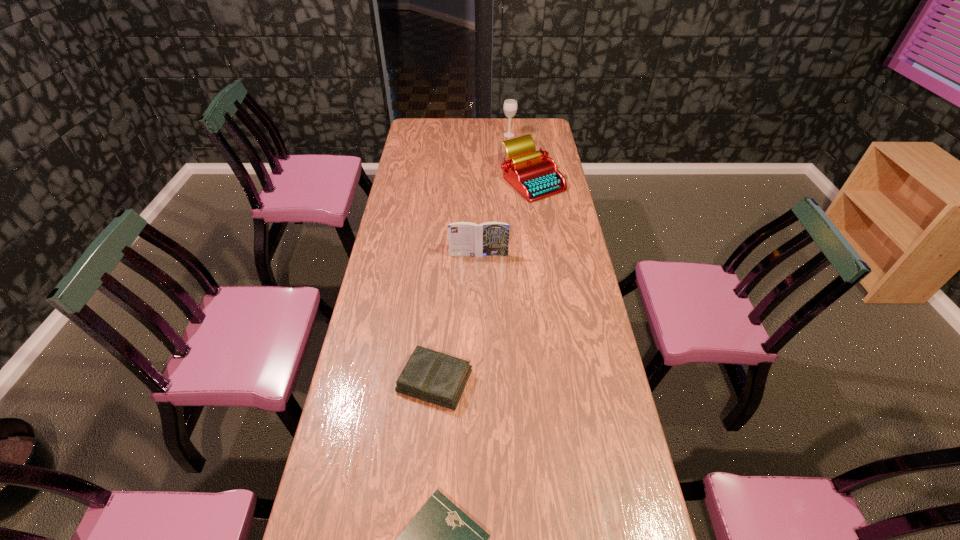
You are a GUI agent. You are given a task and a screenshot of the screen. Output one action in this format:
    pyautogui.click(x=<x>, y=<y>)
    Task: Click on the free space located on the right of the second nearest book
    The height and width of the screenshot is (540, 960).
    Given the screenshot: What is the action you would take?
    pyautogui.click(x=518, y=381)

The width and height of the screenshot is (960, 540). What are the coordinates of `object that is at the far edge` in the screenshot? It's located at (510, 105).

This screenshot has height=540, width=960. In order to click on object positioned at the left edge in this screenshot , I will do `click(434, 377)`.

Locate an element on the screen. The image size is (960, 540). object that is at the right edge is located at coordinates (533, 174).

You are a GUI agent. You are given a task and a screenshot of the screen. Output one action in this format:
    pyautogui.click(x=<x>, y=<y>)
    Task: Click on the vacant space at the far edge of the desktop
    This screenshot has width=960, height=540.
    Given the screenshot: What is the action you would take?
    pyautogui.click(x=495, y=131)

The height and width of the screenshot is (540, 960). I want to click on vacant point at the left edge, so click(x=391, y=233).

In order to click on vacant space at the right edge of the desktop in this screenshot , I will do `click(576, 330)`.

At what (x,y) coordinates should I click in order to perform the action: click on free space between the second nearest object and the farthest object. Please return your answer as a coordinate pair (x, y). The height and width of the screenshot is (540, 960). Looking at the image, I should click on (472, 258).

What are the coordinates of `free spot between the fourth farthest object and the tallest object` in the screenshot? It's located at (472, 258).

The width and height of the screenshot is (960, 540). Find the location of `vacant space that is in between the tallest object and the third farthest object`. vacant space that is in between the tallest object and the third farthest object is located at coordinates (493, 195).